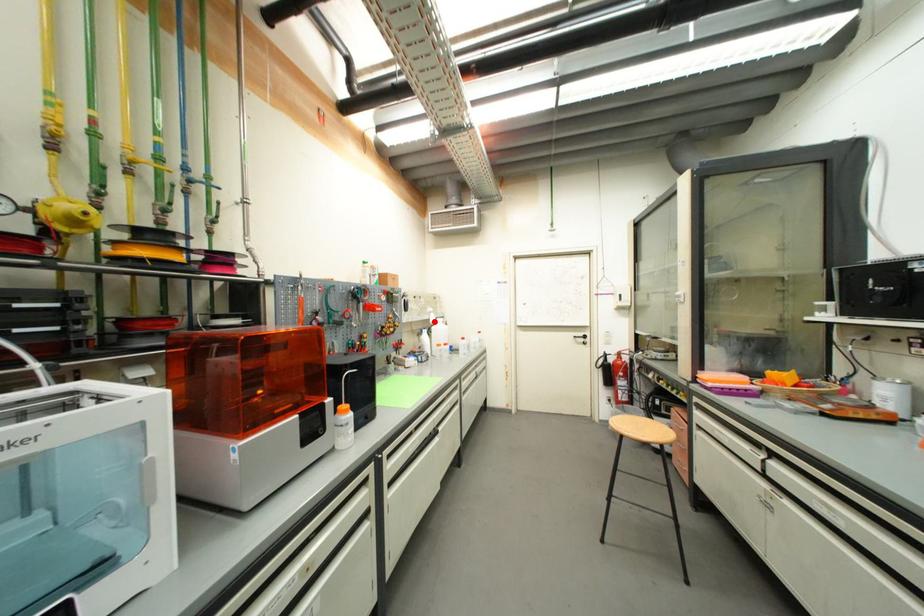
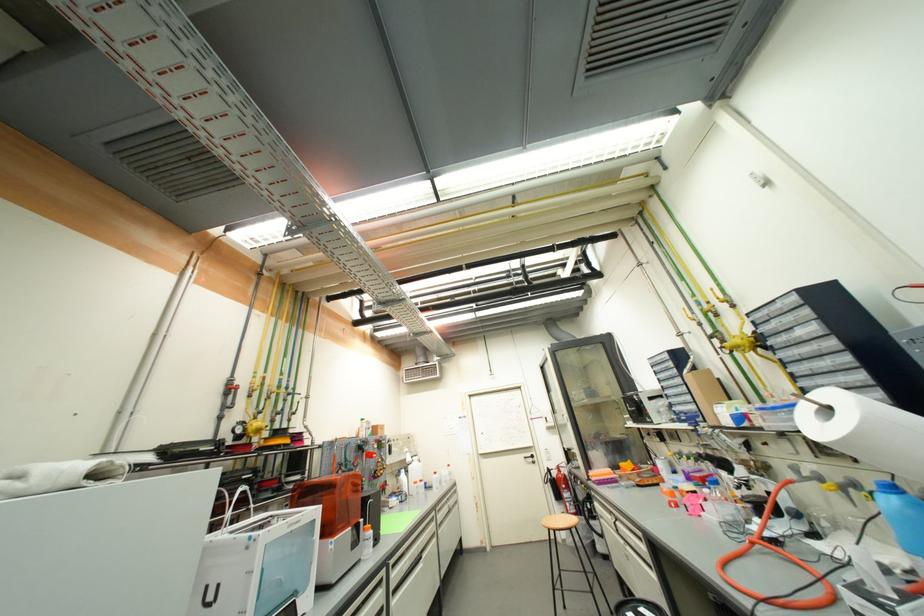
Question: I am providing you with two images of the same scene from different viewpoints. A red point is shown in image1. For the corresponding object point in image2, is it positioned nearer or farther from the camera?

Choices:
 (A) Nearer
 (B) Farther

Answer: (B)